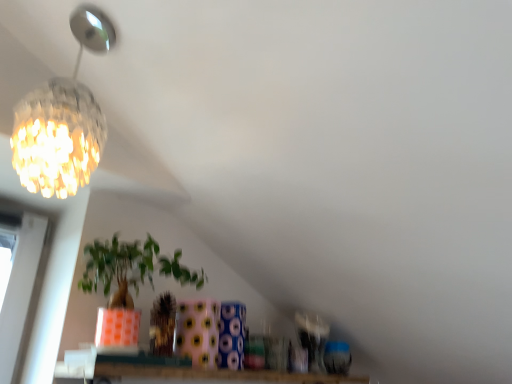
Question: Should I look upward or downward to see matte orange pot at center?

Choices:
 (A) up
 (B) down

Answer: (B)

Question: Could you tell me if transparent glass window at lower center is facing matte orange pot at center?

Choices:
 (A) no
 (B) yes

Answer: (A)

Question: Can matte orange pot at center be found inside transparent glass window at lower center?

Choices:
 (A) yes
 (B) no

Answer: (B)

Question: Is there a large distance between transparent glass window at lower center and matte orange pot at center?

Choices:
 (A) no
 (B) yes

Answer: (A)

Question: Is transparent glass window at lower center positioned with its back to matte orange pot at center?

Choices:
 (A) no
 (B) yes

Answer: (A)

Question: From the image's perspective, is transparent glass window at lower center under matte orange pot at center?

Choices:
 (A) no
 (B) yes

Answer: (B)

Question: From the image's perspective, is transparent glass window at lower center over matte orange pot at center?

Choices:
 (A) yes
 (B) no

Answer: (B)

Question: From a real-world perspective, does matte orange pot at center stand above transparent glass window at lower center?

Choices:
 (A) yes
 (B) no

Answer: (A)

Question: Is matte orange pot at center further to the viewer compared to transparent glass window at lower center?

Choices:
 (A) no
 (B) yes

Answer: (A)

Question: From the image's perspective, is matte orange pot at center above transparent glass window at lower center?

Choices:
 (A) no
 (B) yes

Answer: (B)

Question: Is transparent glass window at lower center at the back of matte orange pot at center?

Choices:
 (A) no
 (B) yes

Answer: (A)

Question: Is matte orange pot at center taller than transparent glass window at lower center?

Choices:
 (A) no
 (B) yes

Answer: (B)

Question: Does matte orange pot at center have a smaller size compared to transparent glass window at lower center?

Choices:
 (A) yes
 (B) no

Answer: (B)

Question: Is crystalline glass chandelier at upper left outside matte orange pot at center?

Choices:
 (A) no
 (B) yes

Answer: (B)